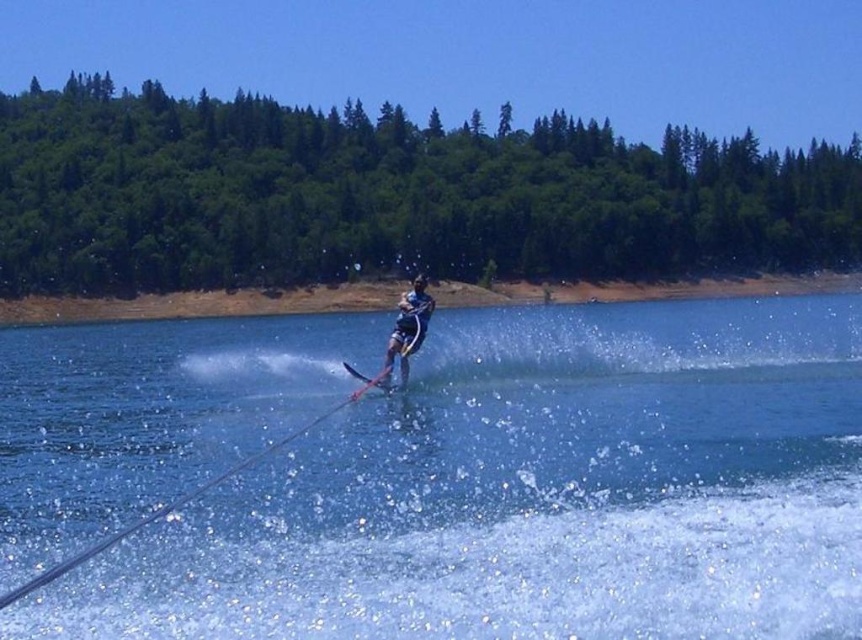
Question: Does green leafy trees at upper center have a larger size compared to shiny metallic ski at center?

Choices:
 (A) yes
 (B) no

Answer: (A)

Question: Is clear blue water at center to the left of green leafy trees at upper center from the viewer's perspective?

Choices:
 (A) yes
 (B) no

Answer: (A)

Question: Which point is farther to the camera?

Choices:
 (A) (398, 356)
 (B) (255, 572)
 (C) (473, 168)
 (D) (357, 397)

Answer: (C)

Question: Among these objects, which one is nearest to the camera?

Choices:
 (A) clear blue water at center
 (B) shiny metallic ski at center
 (C) green leafy trees at upper center
 (D) dark blue fabric wetsuit at center

Answer: (A)

Question: Is clear blue water at center wider than shiny metallic ski at center?

Choices:
 (A) yes
 (B) no

Answer: (A)

Question: Among these points, which one is farthest from the camera?

Choices:
 (A) (398, 365)
 (B) (67, 132)

Answer: (B)